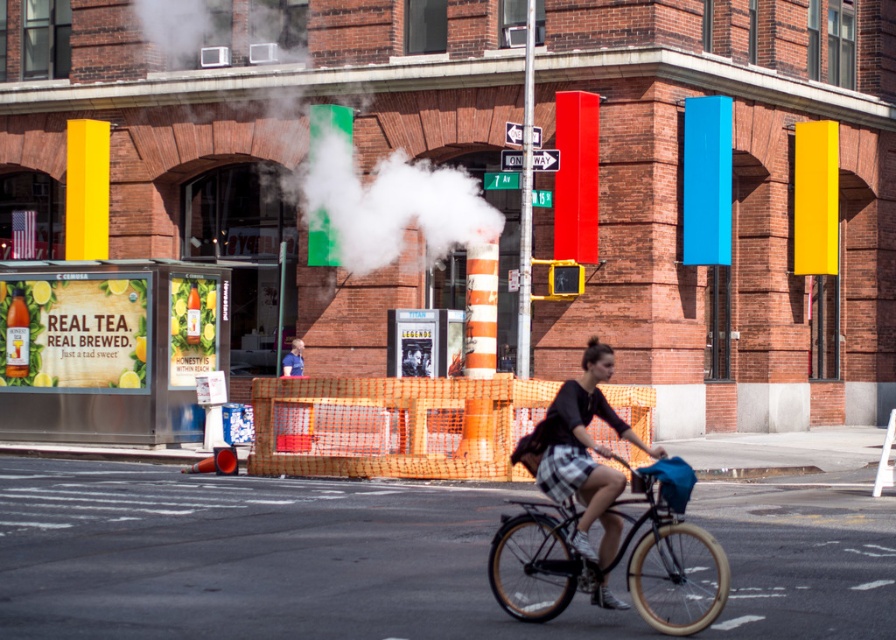
Can you confirm if black matte bicycle at center is positioned to the left of blue shirt at center?

No, black matte bicycle at center is not to the left of blue shirt at center.

Which is behind, point (543, 604) or point (291, 360)?

The point (291, 360) is behind.

Which is in front, point (677, 529) or point (291, 342)?

Point (677, 529) is more forward.

Image resolution: width=896 pixels, height=640 pixels. I want to click on black matte bicycle at center, so click(609, 564).

The height and width of the screenshot is (640, 896). What do you see at coordinates (384, 202) in the screenshot?
I see `white vapor at center` at bounding box center [384, 202].

Can you confirm if white vapor at center is smaller than black matte bicycle at center?

No, white vapor at center is not smaller than black matte bicycle at center.

Identify the location of white vapor at center. (384, 202).

Who is more distant from viewer, (x=432, y=172) or (x=530, y=458)?

The point (x=432, y=172) is behind.

Which of these two, white vapor at center or matte black shirt at center, stands taller?

white vapor at center is taller.

Is point (237, 88) positioned behind point (573, 493)?

That is True.

The height and width of the screenshot is (640, 896). I want to click on white vapor at center, so click(384, 202).